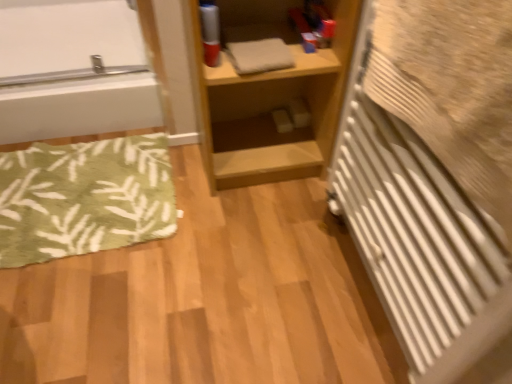
Question: Can we say white glossy bathtub at upper left lies outside light wood shelf at center?

Choices:
 (A) no
 (B) yes

Answer: (B)

Question: Is the depth of white glossy bathtub at upper left less than that of light wood shelf at center?

Choices:
 (A) yes
 (B) no

Answer: (B)

Question: Considering the relative sizes of white glossy bathtub at upper left and light wood shelf at center in the image provided, is white glossy bathtub at upper left shorter than light wood shelf at center?

Choices:
 (A) yes
 (B) no

Answer: (A)

Question: From a real-world perspective, is white glossy bathtub at upper left on light wood shelf at center?

Choices:
 (A) yes
 (B) no

Answer: (B)

Question: From the image's perspective, is white glossy bathtub at upper left located above light wood shelf at center?

Choices:
 (A) no
 (B) yes

Answer: (B)

Question: Is point (31, 139) positioned closer to the camera than point (465, 109)?

Choices:
 (A) closer
 (B) farther

Answer: (B)

Question: In terms of width, does white glossy bathtub at upper left look wider or thinner when compared to white textured radiator at right?

Choices:
 (A) thin
 (B) wide

Answer: (B)

Question: In the image, is white glossy bathtub at upper left on the left side or the right side of white textured radiator at right?

Choices:
 (A) right
 (B) left

Answer: (B)

Question: In the image, is white glossy bathtub at upper left positioned in front of or behind white textured radiator at right?

Choices:
 (A) front
 (B) behind

Answer: (B)

Question: From a real-world perspective, is green leafy rug at lower left physically located above or below white glossy bathtub at upper left?

Choices:
 (A) below
 (B) above

Answer: (A)

Question: Looking at the image, does green leafy rug at lower left seem bigger or smaller compared to white glossy bathtub at upper left?

Choices:
 (A) big
 (B) small

Answer: (B)

Question: From the image's perspective, is green leafy rug at lower left above or below white glossy bathtub at upper left?

Choices:
 (A) above
 (B) below

Answer: (B)

Question: Is green leafy rug at lower left inside or outside of white glossy bathtub at upper left?

Choices:
 (A) inside
 (B) outside

Answer: (B)

Question: In terms of size, does white glossy bathtub at upper left appear bigger or smaller than light wood shelf at center?

Choices:
 (A) big
 (B) small

Answer: (A)

Question: From a real-world perspective, relative to light wood shelf at center, is white glossy bathtub at upper left vertically above or below?

Choices:
 (A) below
 (B) above

Answer: (A)